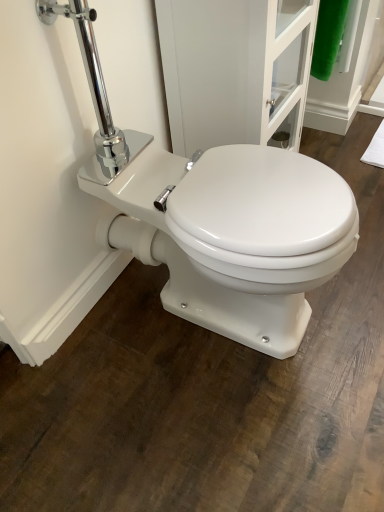
Question: Is white glossy toilet at center shorter than white glossy screen door at center?

Choices:
 (A) yes
 (B) no

Answer: (A)

Question: Considering the relative positions of white glossy toilet at center and white glossy screen door at center in the image provided, is white glossy toilet at center to the right of white glossy screen door at center from the viewer's perspective?

Choices:
 (A) yes
 (B) no

Answer: (B)

Question: From a real-world perspective, is white glossy toilet at center on top of white glossy screen door at center?

Choices:
 (A) yes
 (B) no

Answer: (B)

Question: Is white glossy toilet at center oriented away from white glossy screen door at center?

Choices:
 (A) no
 (B) yes

Answer: (A)

Question: From a real-world perspective, does white glossy toilet at center sit lower than white glossy screen door at center?

Choices:
 (A) no
 (B) yes

Answer: (B)

Question: From the image's perspective, is white glossy toilet at center located beneath white glossy screen door at center?

Choices:
 (A) yes
 (B) no

Answer: (A)

Question: Is white glossy toilet at center located within white glossy screen door at center?

Choices:
 (A) no
 (B) yes

Answer: (A)

Question: Is white glossy screen door at center wider than white glossy toilet at center?

Choices:
 (A) yes
 (B) no

Answer: (B)

Question: Can you confirm if white glossy screen door at center is taller than white glossy toilet at center?

Choices:
 (A) no
 (B) yes

Answer: (B)

Question: Can you see white glossy screen door at center touching white glossy toilet at center?

Choices:
 (A) yes
 (B) no

Answer: (B)

Question: Could you tell me if white glossy screen door at center is facing white glossy toilet at center?

Choices:
 (A) no
 (B) yes

Answer: (A)

Question: Is white glossy screen door at center positioned before white glossy toilet at center?

Choices:
 (A) yes
 (B) no

Answer: (B)

Question: Which is correct: white glossy screen door at center is inside white glossy toilet at center, or outside of it?

Choices:
 (A) outside
 (B) inside

Answer: (A)